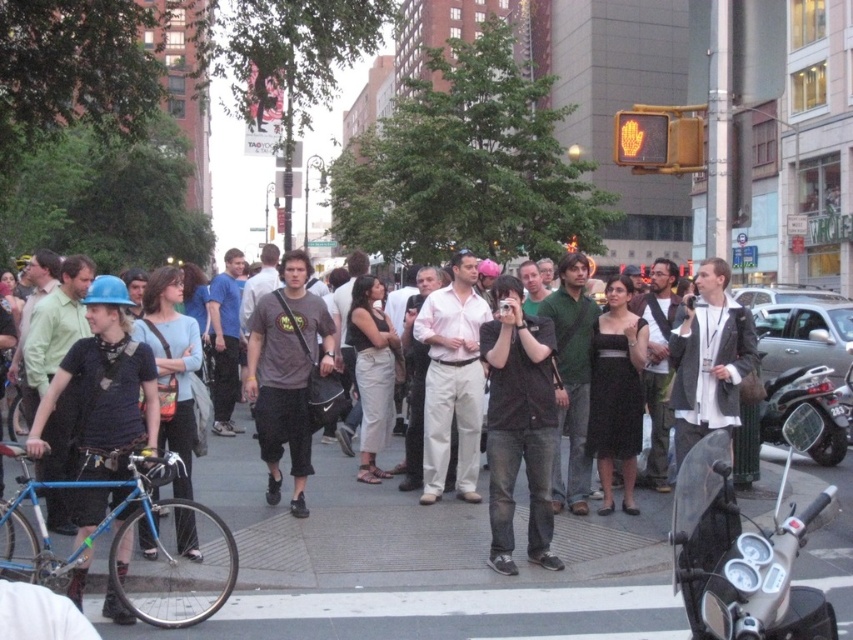
Looking at this image, how far apart are metallic silver scooter at lower right and shiny black scooter at right?

The distance of metallic silver scooter at lower right from shiny black scooter at right is 6.88 meters.

Does metallic silver scooter at lower right appear on the left side of shiny black scooter at right?

Yes, metallic silver scooter at lower right is to the left of shiny black scooter at right.

Locate an element on the screen. The width and height of the screenshot is (853, 640). metallic silver scooter at lower right is located at coordinates (744, 548).

I want to click on metallic silver scooter at lower right, so click(744, 548).

Is black matte shirt at center thinner than matte gray t-shirt at center?

Indeed, black matte shirt at center has a lesser width compared to matte gray t-shirt at center.

Which is more to the right, black matte shirt at center or matte gray t-shirt at center?

From the viewer's perspective, black matte shirt at center appears more on the right side.

Between point (502, 528) and point (260, 408), which one is positioned in front?

Point (502, 528) is in front.

Where is `black matte shirt at center`? The width and height of the screenshot is (853, 640). black matte shirt at center is located at coordinates (518, 424).

Can you confirm if matte black shirt at center is taller than metallic silver scooter at lower right?

No, matte black shirt at center is not taller than metallic silver scooter at lower right.

In the scene shown: Between matte black shirt at center and metallic silver scooter at lower right, which one has more height?

Standing taller between the two is metallic silver scooter at lower right.

Between point (318, 484) and point (822, 504), which one is positioned in front?

Point (822, 504)

You are a GUI agent. You are given a task and a screenshot of the screen. Output one action in this format:
    pyautogui.click(x=<x>, y=<y>)
    Task: Click on the matte black shirt at center
    This screenshot has width=853, height=640.
    Given the screenshot: What is the action you would take?
    pyautogui.click(x=335, y=524)